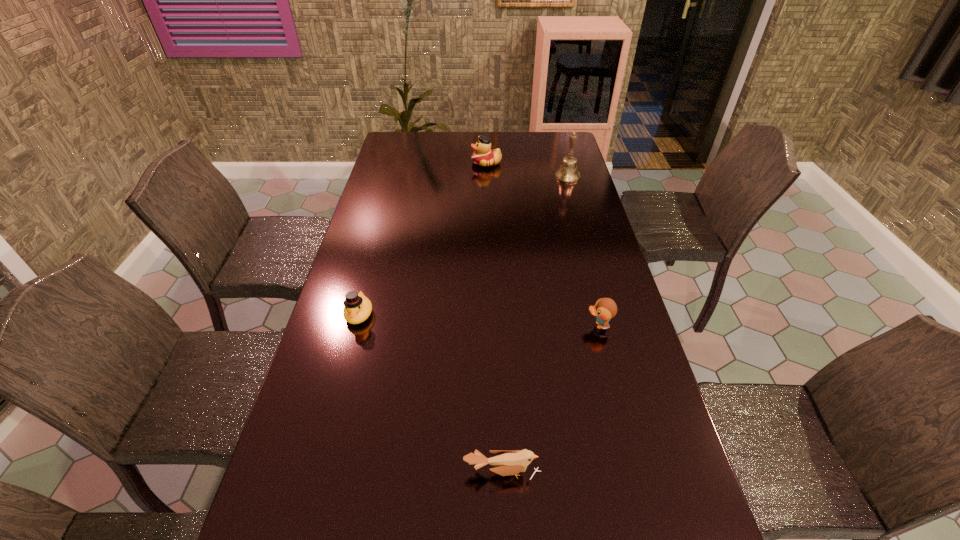
Point out which duck is positioned as the nearest to the leftmost object. Please provide its 2D coordinates. Your answer should be formatted as a tuple, i.e. [(x, y)], where the tuple contains the x and y coordinates of a point satisfying the conditions above.

[(605, 309)]